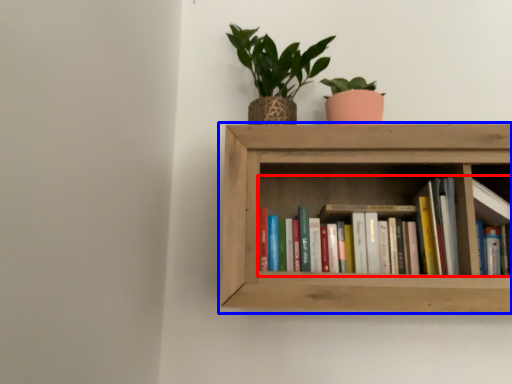
Question: Which of the following is the closest to the observer, book (highlighted by a red box) or shelf (highlighted by a blue box)?

Choices:
 (A) book
 (B) shelf

Answer: (B)